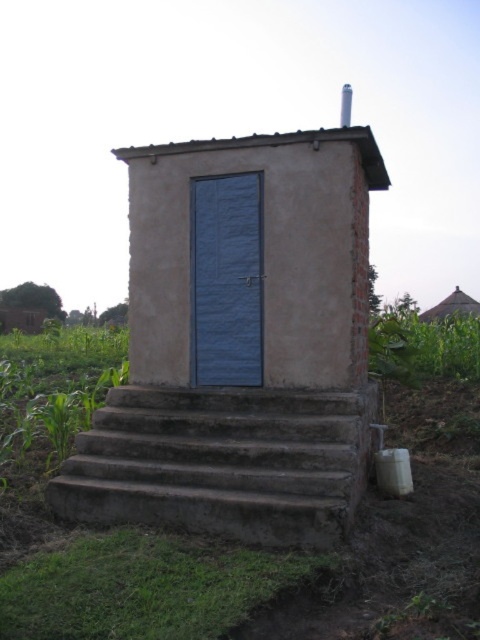
Question: Which of the following is the closest to the observer?

Choices:
 (A) (232, 332)
 (B) (444, 308)
 (C) (119, 492)

Answer: (C)

Question: Which point is farther to the camera?

Choices:
 (A) (86, 483)
 (B) (457, 304)
 (C) (245, 204)

Answer: (B)

Question: Does concrete stairs at lower center appear over brown thatched roof at upper right?

Choices:
 (A) no
 (B) yes

Answer: (A)

Question: Which point is closer to the camera?

Choices:
 (A) (257, 285)
 (B) (446, 296)
 (C) (288, 518)

Answer: (C)

Question: Is concrete stairs at lower center below blue fabric door at center?

Choices:
 (A) yes
 (B) no

Answer: (A)

Question: Is concrete stairs at lower center smaller than brown thatched roof at upper right?

Choices:
 (A) no
 (B) yes

Answer: (B)